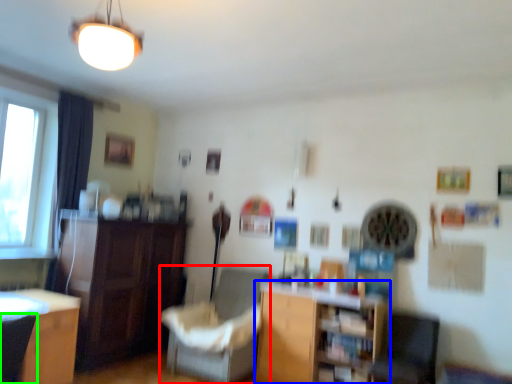
Question: Based on their relative distances, which object is farther from chair (highlighted by a red box)? Choose from shelf (highlighted by a blue box) and armchair (highlighted by a green box).

Choices:
 (A) shelf
 (B) armchair

Answer: (B)